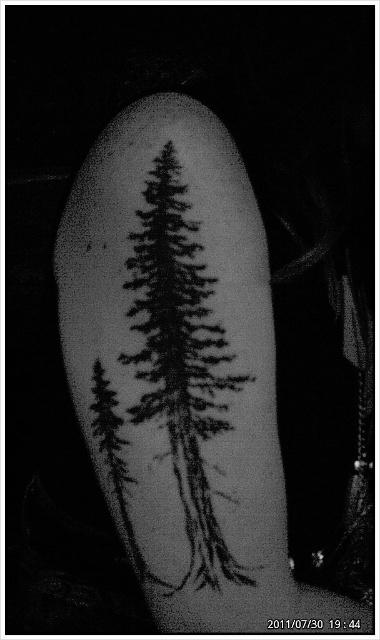
You are an artist trying to replicate the tattoo. You have a stencil of the black ink tattoo at center and another of the black ink tree at center. Which stencil is larger in width?

The black ink tattoo at center might be wider than black ink tree at center according to the description.

You are a tattoo artist trying to place a new small star tattoo between the black ink tattoo at center and the black ink tree at center. The star requires 1.5 centimeters of space. Is there enough space between them?

The black ink tattoo at center and the black ink tree at center are 2.24 centimeters apart. Since the star requires 1.5 centimeters, there is enough space between them to place the star.